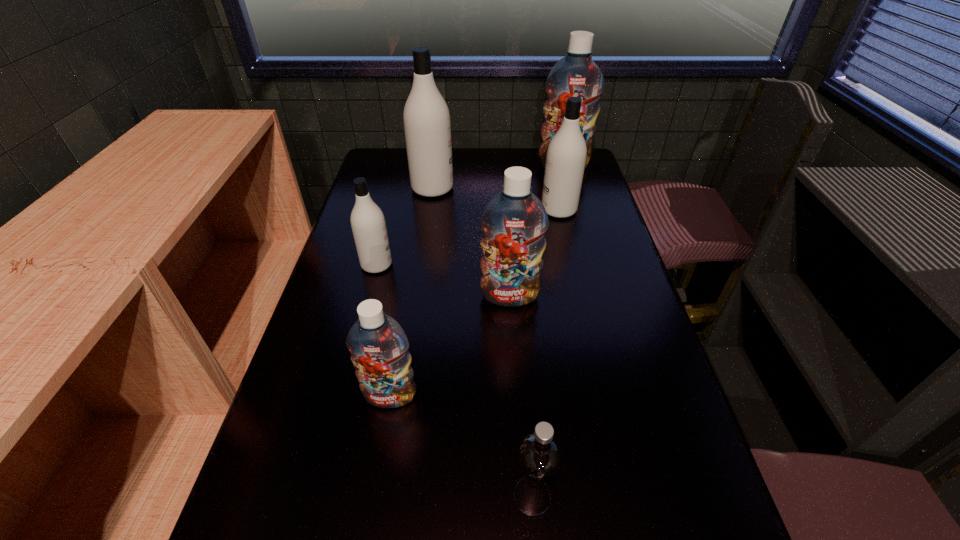
You are a GUI agent. You are given a task and a screenshot of the screen. Output one action in this format:
    pyautogui.click(x=<x>, y=<y>)
    Task: Click on the vacant space that satisfies the following two spatial constraints: 1. on the front label of the farthest object; 2. on the front-facing side of the rightmost white shampoo
    This screenshot has width=960, height=540.
    Given the screenshot: What is the action you would take?
    pyautogui.click(x=576, y=210)

I want to click on blank space that satisfies the following two spatial constraints: 1. on the front label of the farthest object; 2. on the front-facing side of the fourth farthest shampoo, so click(x=591, y=265).